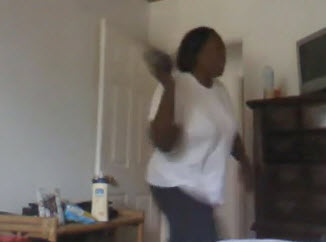
Where is `book`? The width and height of the screenshot is (326, 242). book is located at coordinates (51, 202).